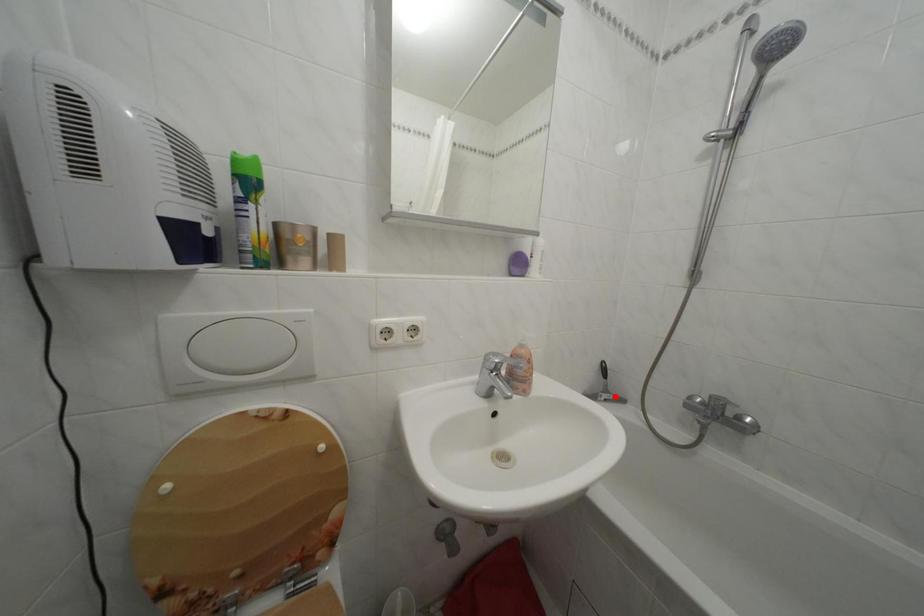
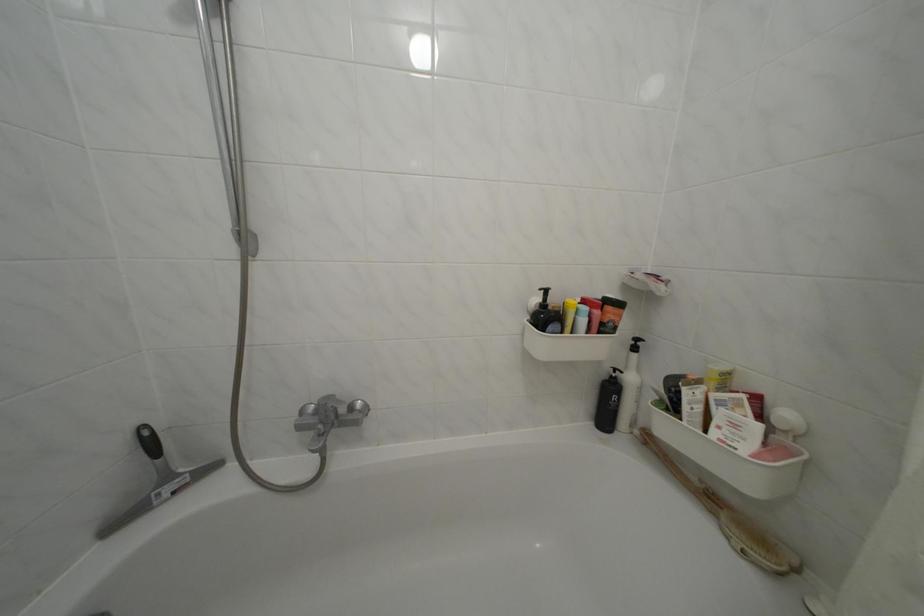
Find the pixel in the second image that matches the highlighted location in the first image.

(176, 484)